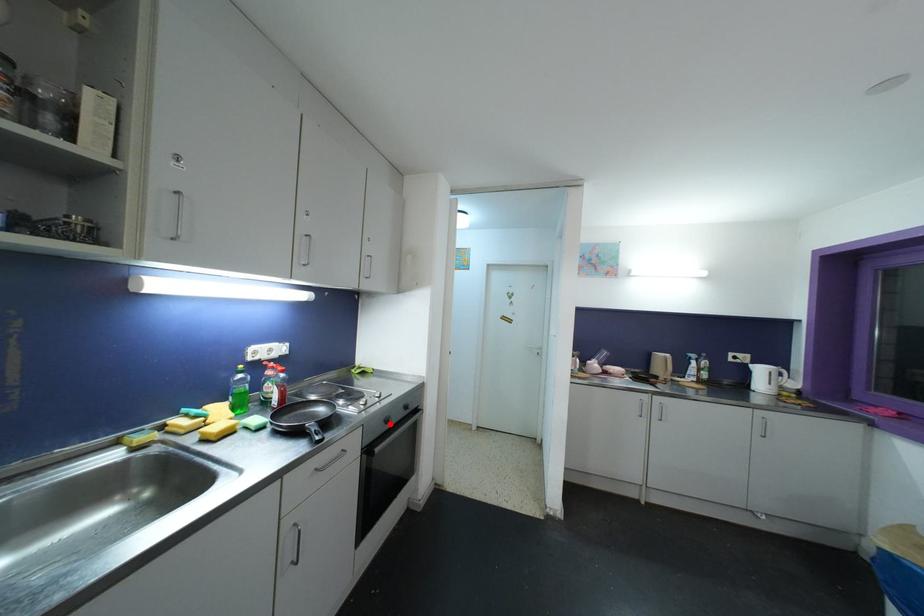
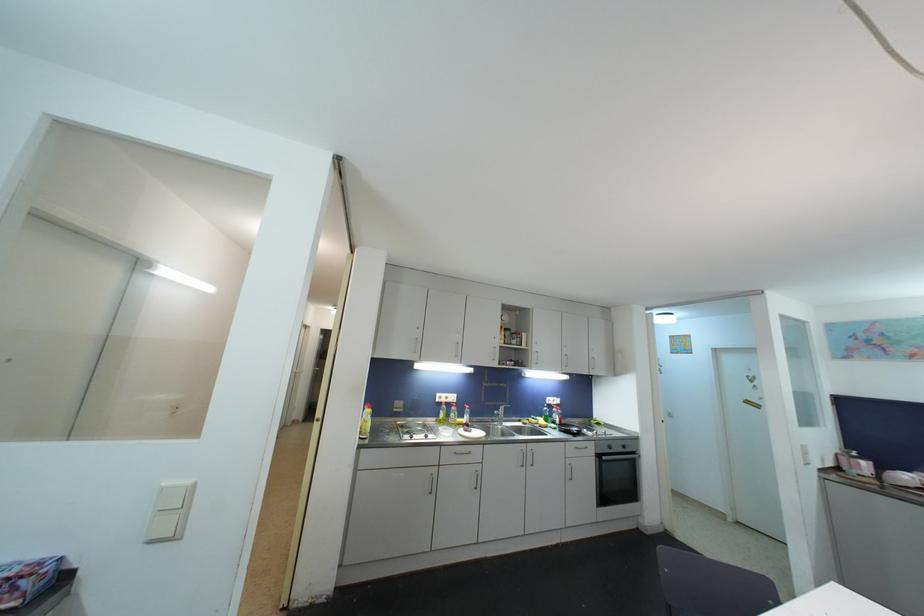
The point at the highlighted location is marked in the first image. Where is the corresponding point in the second image?

(613, 450)